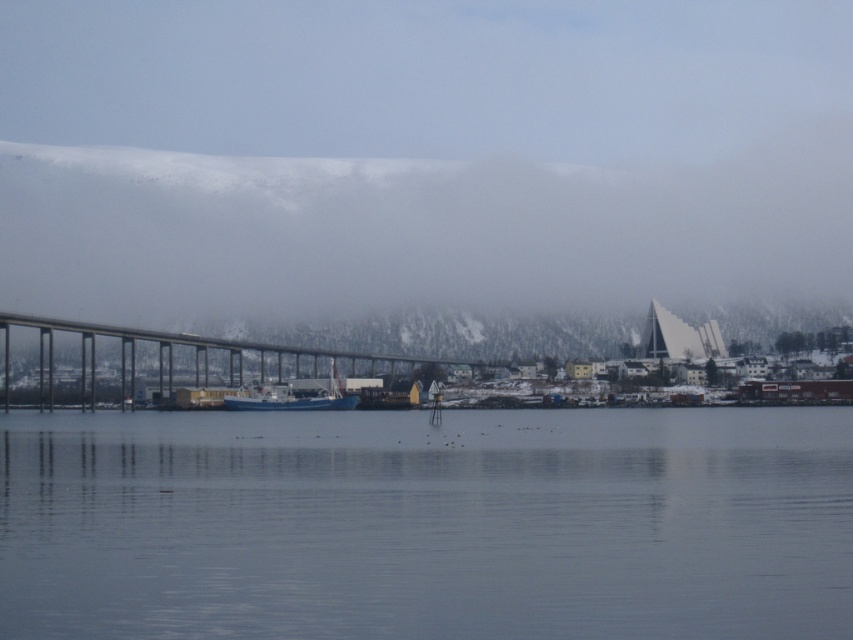
Question: Which of the following is the farthest from the observer?

Choices:
 (A) (335, 396)
 (B) (198, 333)
 (C) (35, 552)

Answer: (B)

Question: Among these points, which one is farthest from the camera?

Choices:
 (A) (267, 344)
 (B) (258, 397)
 (C) (286, 440)

Answer: (A)

Question: Can you confirm if transparent water at center is bigger than blue matte boat at center?

Choices:
 (A) yes
 (B) no

Answer: (A)

Question: Is transparent water at center positioned in front of blue matte boat at center?

Choices:
 (A) no
 (B) yes

Answer: (B)

Question: Which of the following is the farthest from the observer?

Choices:
 (A) metallic gray bridge at center
 (B) blue matte boat at center
 (C) transparent water at center

Answer: (A)

Question: Does metallic gray bridge at center have a larger size compared to blue matte boat at center?

Choices:
 (A) no
 (B) yes

Answer: (B)